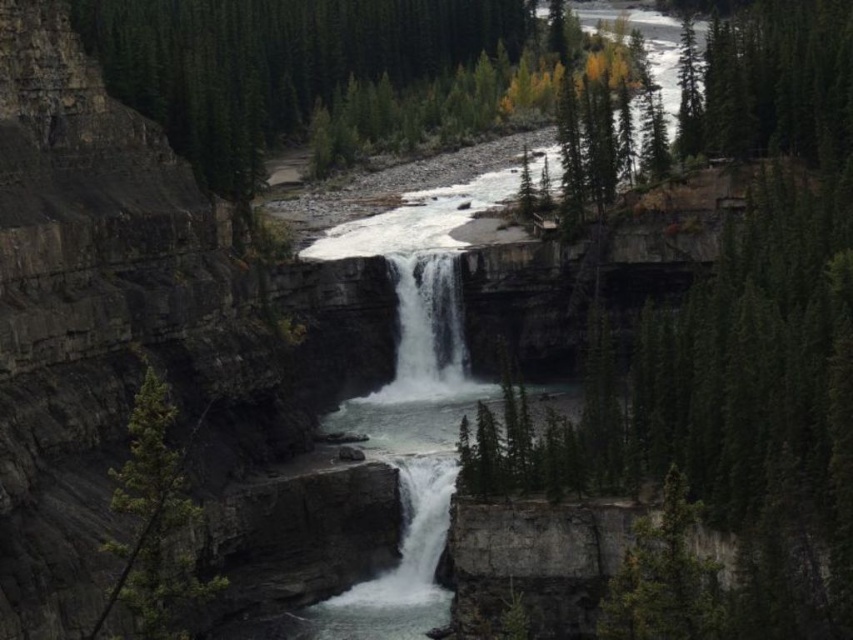
You are a hiker standing at the base of the waterfall. You want to place a 50 meter long rope between the green textured tree at left and the white frothy water at center to measure the distance. Will the rope be long enough?

The distance between the green textured tree at left and the white frothy water at center is 40.54 meters, so a 50 meter rope would be sufficient as it is longer than the required distance.

In the scene shown: You are standing at the edge of the cliff overlooking the waterfall and the river. You see a green textured tree at left and white frothy water at center. Which object is positioned lower in the scene?

The green textured tree at left is positioned lower than the white frothy water at center because it is located below it.

From the picture: You are a hiker standing at the edge of the river below the waterfall. You notice a green textured tree at left and a white frothy water at center. Which object would block your view of the other if you were to stand directly between them?

The green textured tree at left is larger in size than the white frothy water at center, so if you stand between them, the larger green textured tree at left would block your view of the white frothy water at center.